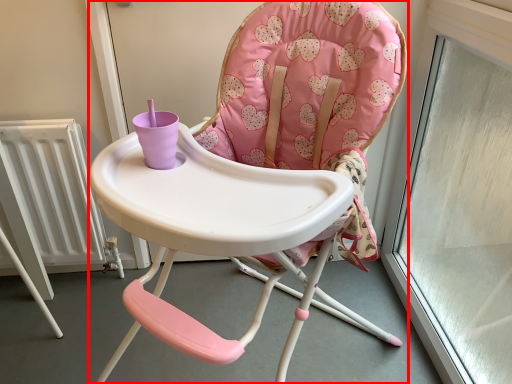
Question: From the image's perspective, where is chair (annotated by the red box) located relative to radiator?

Choices:
 (A) above
 (B) below

Answer: (B)